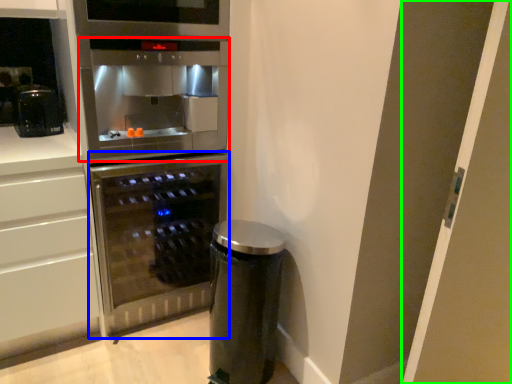
Question: Based on their relative distances, which object is nearer to oven (highlighted by a red box)? Choose from home appliance (highlighted by a blue box) and glass door (highlighted by a green box).

Choices:
 (A) home appliance
 (B) glass door

Answer: (A)